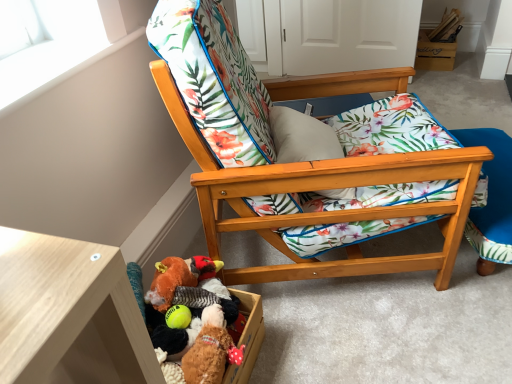
The image size is (512, 384). Identify the location of empty space that is ontop of white matte window screen at upper left (from a real-world perspective). (48, 62).